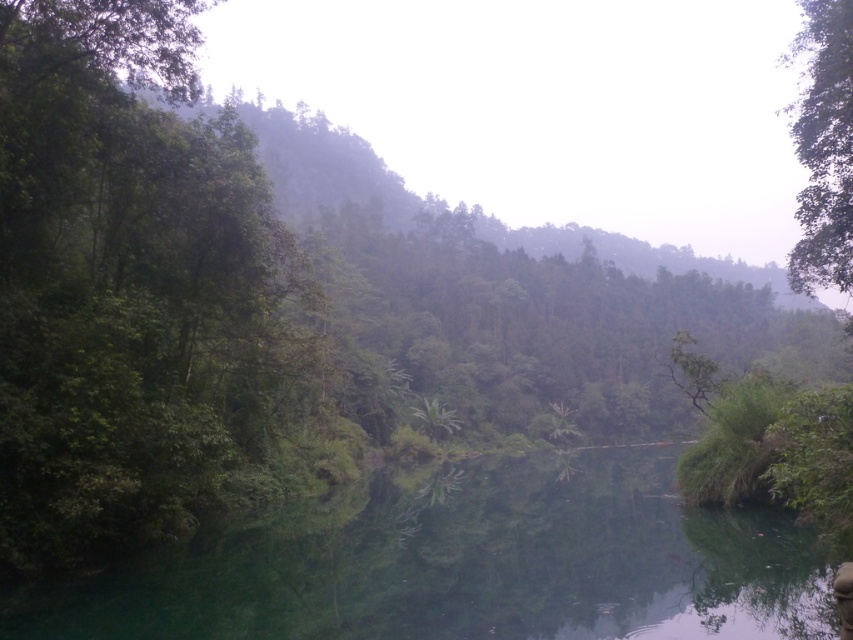
Question: Is green glossy water at center behind green leafy tree at upper right?

Choices:
 (A) yes
 (B) no

Answer: (B)

Question: Which object appears farthest from the camera in this image?

Choices:
 (A) green glossy water at center
 (B) green leafy tree at upper right

Answer: (B)

Question: Which point is farther to the camera?

Choices:
 (A) green leafy tree at upper right
 (B) green glossy water at center

Answer: (A)

Question: Can you confirm if green glossy water at center is positioned above green leafy tree at upper right?

Choices:
 (A) yes
 (B) no

Answer: (B)

Question: Does green glossy water at center appear on the left side of green leafy tree at upper right?

Choices:
 (A) no
 (B) yes

Answer: (B)